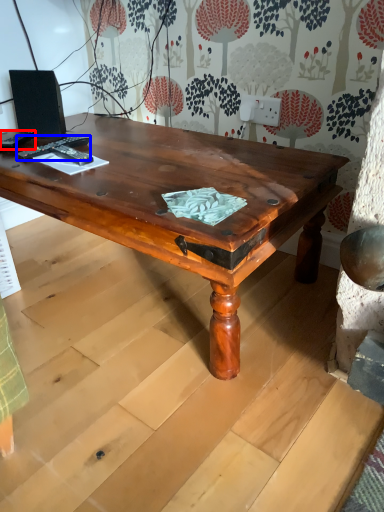
Question: Which point is further to the camera, remote control (highlighted by a red box) or remote control (highlighted by a blue box)?

Choices:
 (A) remote control
 (B) remote control

Answer: (A)